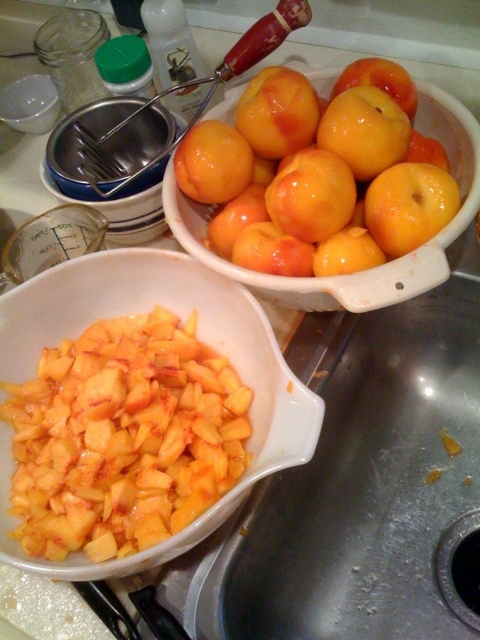
Who is lower down, transparent plastic bowl at upper left or orange matte apple at center?

orange matte apple at center is below.

Who is more distant from viewer, (x=11, y=86) or (x=345, y=70)?

The point (x=11, y=86) is behind.

What do you see at coordinates (29, 104) in the screenshot? This screenshot has height=640, width=480. I see `transparent plastic bowl at upper left` at bounding box center [29, 104].

Identify the location of transparent plastic bowl at upper left. (29, 104).

What do you see at coordinates (347, 252) in the screenshot?
I see `glossy yellow-orange fruit at center` at bounding box center [347, 252].

Between point (358, 262) and point (350, 68), which one is positioned in front?

Positioned in front is point (358, 262).

This screenshot has width=480, height=640. Find the location of `glossy yellow-orange fruit at center`. glossy yellow-orange fruit at center is located at coordinates (347, 252).

In the scene shown: Can you confirm if yellow matte diced peaches at center is bigger than matte yellow-orange fruit at upper center?

Yes, yellow matte diced peaches at center is bigger than matte yellow-orange fruit at upper center.

Does yellow matte diced peaches at center have a smaller size compared to matte yellow-orange fruit at upper center?

Actually, yellow matte diced peaches at center might be larger than matte yellow-orange fruit at upper center.

The height and width of the screenshot is (640, 480). Find the location of `yellow matte diced peaches at center`. yellow matte diced peaches at center is located at coordinates (199, 337).

Locate an element on the screen. The image size is (480, 640). yellow matte diced peaches at center is located at coordinates (199, 337).